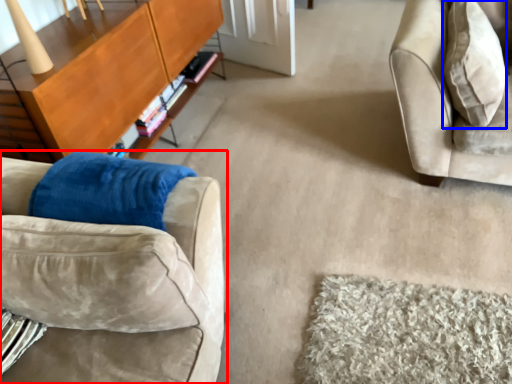
Question: Among these objects, which one is farthest to the camera, studio couch (highlighted by a red box) or throw pillow (highlighted by a blue box)?

Choices:
 (A) studio couch
 (B) throw pillow

Answer: (B)